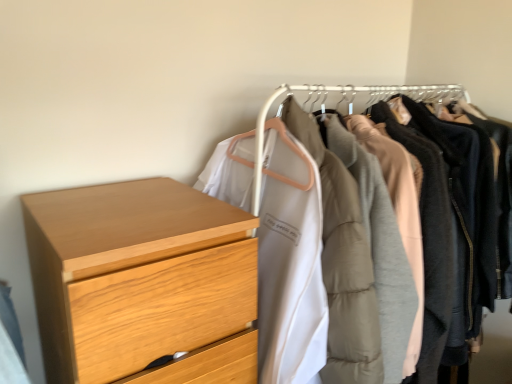
The width and height of the screenshot is (512, 384). What do you see at coordinates (382, 166) in the screenshot? I see `matte white coat at center` at bounding box center [382, 166].

Locate an element on the screen. Image resolution: width=512 pixels, height=384 pixels. matte white coat at center is located at coordinates (382, 166).

This screenshot has width=512, height=384. What do you see at coordinates (142, 282) in the screenshot?
I see `light wood chest of drawers at left` at bounding box center [142, 282].

Where is `light wood chest of drawers at left`? Image resolution: width=512 pixels, height=384 pixels. light wood chest of drawers at left is located at coordinates (142, 282).

Find the location of a particular element. Image resolution: width=512 pixels, height=384 pixels. matte white coat at center is located at coordinates (382, 166).

Which object is positioned more to the left, matte white coat at center or light wood chest of drawers at left?

light wood chest of drawers at left.

Looking at this image, between matte white coat at center and light wood chest of drawers at left, which one is positioned behind?

matte white coat at center is further away from the camera.

Which point is more forward, (447, 118) or (178, 225)?

The point (178, 225) is closer to the camera.

From the image's perspective, which is above, matte white coat at center or light wood chest of drawers at left?

matte white coat at center, from the image's perspective.

From a real-world perspective, which object rests below the other?

matte white coat at center, from a real-world perspective.

Does matte white coat at center have a greater width compared to light wood chest of drawers at left?

Yes.

Between matte white coat at center and light wood chest of drawers at left, which one has less height?

light wood chest of drawers at left is shorter.

Is matte white coat at center bigger or smaller than light wood chest of drawers at left?

In the image, matte white coat at center appears to be larger than light wood chest of drawers at left.

Is matte white coat at center surrounding light wood chest of drawers at left?

That's incorrect, light wood chest of drawers at left is not inside matte white coat at center.

Is matte white coat at center directly adjacent to light wood chest of drawers at left?

matte white coat at center and light wood chest of drawers at left are not in contact.

Is matte white coat at center turned away from light wood chest of drawers at left?

matte white coat at center is not turned away from light wood chest of drawers at left.

You are a GUI agent. You are given a task and a screenshot of the screen. Output one action in this format:
    pyautogui.click(x=<x>, y=<y>)
    Task: Click on the chest of drawers located in front of the matte white coat at center
    This screenshot has height=384, width=512.
    Given the screenshot: What is the action you would take?
    pyautogui.click(x=142, y=282)

Visually, is light wood chest of drawers at left positioned to the left or to the right of matte white coat at center?

In the image, light wood chest of drawers at left appears on the left side of matte white coat at center.

Which object is closer to the camera taking this photo, light wood chest of drawers at left or matte white coat at center?

Positioned in front is light wood chest of drawers at left.

Between point (121, 320) and point (378, 97), which one is positioned in front?

The point (121, 320) is closer to the camera.

From the image's perspective, which one is positioned higher, light wood chest of drawers at left or matte white coat at center?

matte white coat at center.

From a real-world perspective, which is physically above, light wood chest of drawers at left or matte white coat at center?

light wood chest of drawers at left, from a real-world perspective.

From the picture: Is light wood chest of drawers at left thinner than matte white coat at center?

Correct, the width of light wood chest of drawers at left is less than that of matte white coat at center.

Between light wood chest of drawers at left and matte white coat at center, which one has less height?

Standing shorter between the two is light wood chest of drawers at left.

Which of these two, light wood chest of drawers at left or matte white coat at center, is bigger?

Bigger between the two is matte white coat at center.

Is light wood chest of drawers at left situated inside matte white coat at center or outside?

light wood chest of drawers at left is located beyond the bounds of matte white coat at center.

Does light wood chest of drawers at left touch matte white coat at center?

light wood chest of drawers at left and matte white coat at center are clearly separated.

Is light wood chest of drawers at left positioned with its back to matte white coat at center?

No.

Can you tell me how much light wood chest of drawers at left and matte white coat at center differ in facing direction?

There is a 2.38-degree angle between the facing directions of light wood chest of drawers at left and matte white coat at center.

Identify the location of chest of drawers lying on the left of matte white coat at center. (142, 282).

Where is `closet behind the light wood chest of drawers at left`? closet behind the light wood chest of drawers at left is located at coordinates (382, 166).

The image size is (512, 384). I want to click on closet below the light wood chest of drawers at left (from a real-world perspective), so pos(382,166).